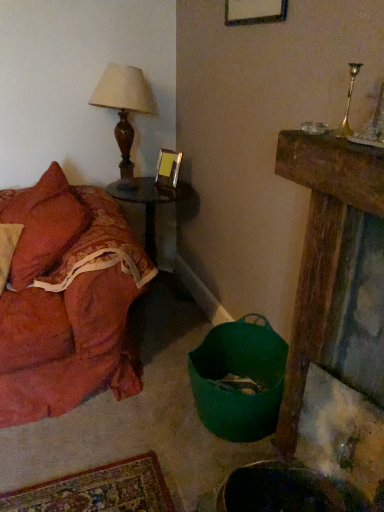
What are the coordinates of `vacant space positioned to the left of metallic gold picture frame at upper center` in the screenshot? It's located at (151, 184).